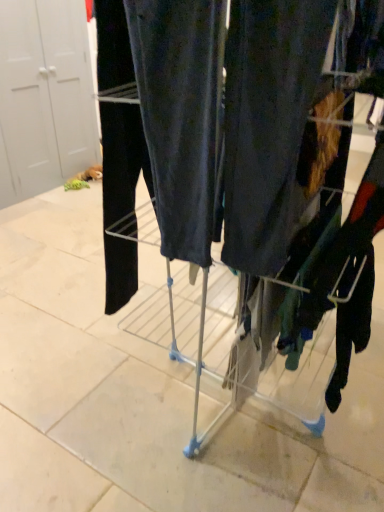
Find the location of a particular element. free area below metallic silver trolley at center (from a real-world perspective) is located at coordinates (240, 415).